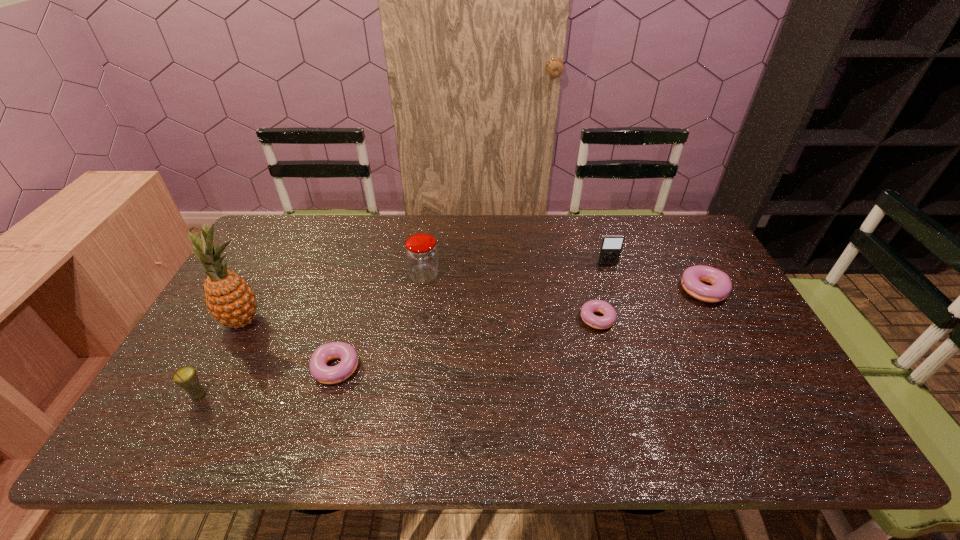
The image size is (960, 540). I want to click on unoccupied area between the jar and the pineapple, so click(x=334, y=299).

Locate an element on the screen. The width and height of the screenshot is (960, 540). free area in between the fourth object from left to right and the pineapple is located at coordinates (334, 299).

You are a GUI agent. You are given a task and a screenshot of the screen. Output one action in this format:
    pyautogui.click(x=<x>, y=<y>)
    Task: Click on the vacant region between the iPod and the jar
    
    Given the screenshot: What is the action you would take?
    pyautogui.click(x=516, y=270)

I want to click on free area in between the nearest doughnut and the tallest object, so [x=292, y=345].

Where is `free area in between the jar and the straw for drinking`? This screenshot has width=960, height=540. free area in between the jar and the straw for drinking is located at coordinates (312, 336).

At what (x,y) coordinates should I click in order to perform the action: click on empty space that is in between the shortest doughnut and the fourth object from right to left. Please return your answer as a coordinate pair (x, y). Looking at the image, I should click on (511, 296).

Image resolution: width=960 pixels, height=540 pixels. What are the coordinates of `free space between the fourth object from left to right and the straw for drinking` in the screenshot? It's located at click(x=312, y=336).

Where is `free space between the fourth object from left to right and the tallest object`? Image resolution: width=960 pixels, height=540 pixels. free space between the fourth object from left to right and the tallest object is located at coordinates (334, 299).

Where is `empty space that is in between the shortest doughnut and the iPod`? This screenshot has height=540, width=960. empty space that is in between the shortest doughnut and the iPod is located at coordinates (602, 290).

Find the location of a particular element. The image size is (960, 540). free point between the second doughnut from left to right and the pineapple is located at coordinates (420, 319).